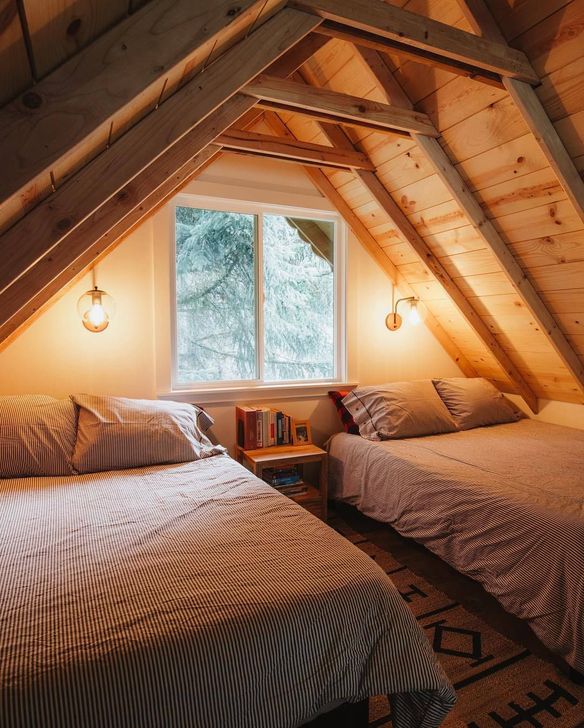
What are the coordinates of `books` in the screenshot? It's located at (285, 488), (264, 434).